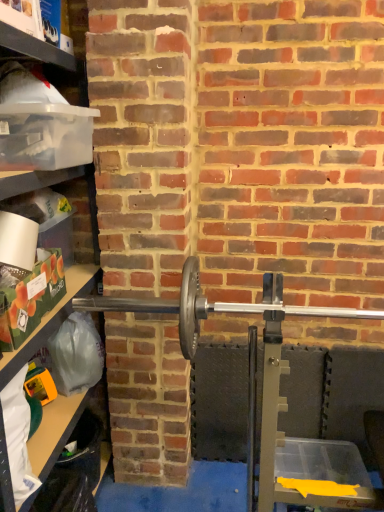
Question: In the image, is polished silver barbell at center on the left side or the right side of clear plastic container at left?

Choices:
 (A) left
 (B) right

Answer: (B)

Question: Considering the positions of polished silver barbell at center and clear plastic container at left in the image, is polished silver barbell at center bigger or smaller than clear plastic container at left?

Choices:
 (A) small
 (B) big

Answer: (A)

Question: In terms of height, does polished silver barbell at center look taller or shorter compared to clear plastic container at left?

Choices:
 (A) short
 (B) tall

Answer: (A)

Question: From the image's perspective, is clear plastic container at left above or below polished silver barbell at center?

Choices:
 (A) above
 (B) below

Answer: (B)

Question: From a real-world perspective, is clear plastic container at left physically located above or below polished silver barbell at center?

Choices:
 (A) above
 (B) below

Answer: (B)

Question: Is clear plastic container at left inside or outside of polished silver barbell at center?

Choices:
 (A) outside
 (B) inside

Answer: (A)

Question: In terms of size, does clear plastic container at left appear bigger or smaller than polished silver barbell at center?

Choices:
 (A) small
 (B) big

Answer: (B)